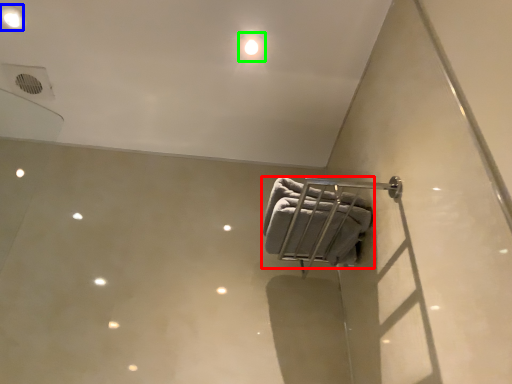
Question: Which object is the closest to the towel (highlighted by a red box)? Choose among these: dot (highlighted by a blue box) or dot (highlighted by a green box).

Choices:
 (A) dot
 (B) dot

Answer: (B)